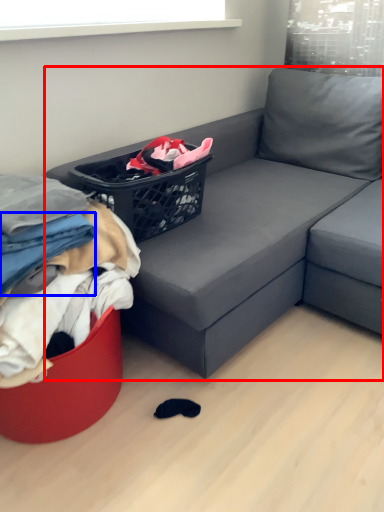
Question: Which object appears farthest to the camera in this image, studio couch (highlighted by a red box) or clothing (highlighted by a blue box)?

Choices:
 (A) studio couch
 (B) clothing

Answer: (B)